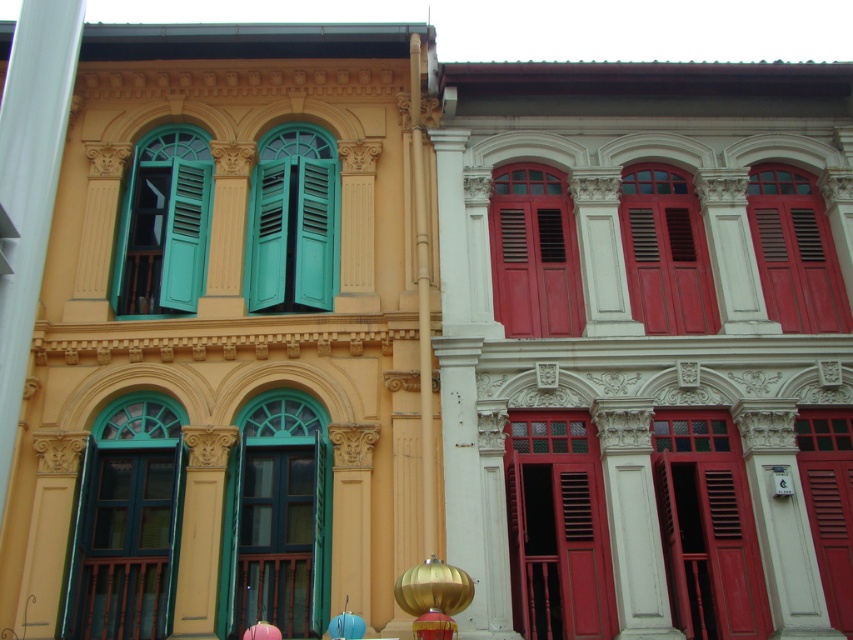
Based on the photo, you are an architect analyzing the two buildings. The green matte window at left and the matte red wooden window at center are both part of the left building. Which window has a greater height?

The green matte window at left is much taller than the matte red wooden window at center, so the green matte window at left has a greater height.

You are standing in front of the two buildings and want to know which window is closer to you. The green matte window at left and the matte red wooden window at center are both visible. Which one is closer?

The green matte window at left is closer to you than the matte red wooden window at center because it is positioned further to the viewer.

You are standing in front of the two buildings and want to know which window is closer to you. Which one is closer between the green matte window at left and the matte red window at center?

The green matte window at left is closer to you because it is further to the viewer than the matte red window at center.